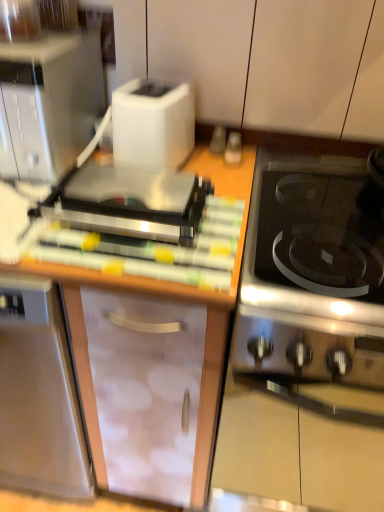
Where is `vacant area on top of black glass cooktop at right (from a real-world perspective)`? The height and width of the screenshot is (512, 384). vacant area on top of black glass cooktop at right (from a real-world perspective) is located at coordinates (349, 227).